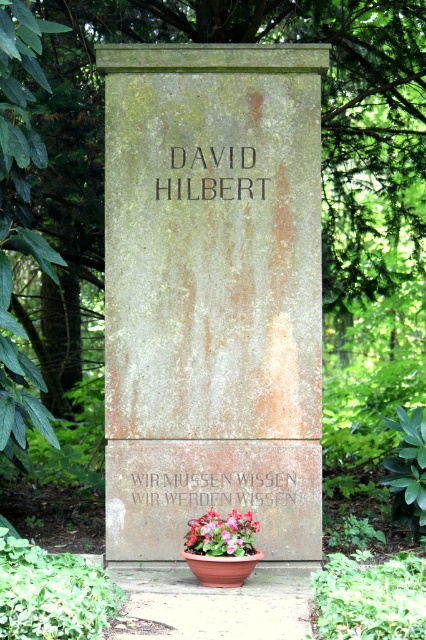
Based on the photo, you are a photographer trying to capture a clear shot of the black stone writing at center without any obstruction. However, there is a green leafy tree at upper center in the frame. Based on the scene description, will the tree block the view of the stone writing?

The green leafy tree at upper center is taller than the black stone writing at center, so the tree may obstruct the view of the stone writing depending on their positions. Since the tree is taller, it might be positioned in front or above the stone writing, potentially blocking it from certain angles.

Looking at this image, you are standing in front of a monument and notice both the black stone writing at center and the floral arrangement at center. Which object is positioned higher up?

→ The black stone writing at center is above the floral arrangement at center, so it is positioned higher up.

What is the relationship in size between the black stone writing at center and the floral arrangement at center in the image?

The black stone writing at center is smaller than the floral arrangement at center.